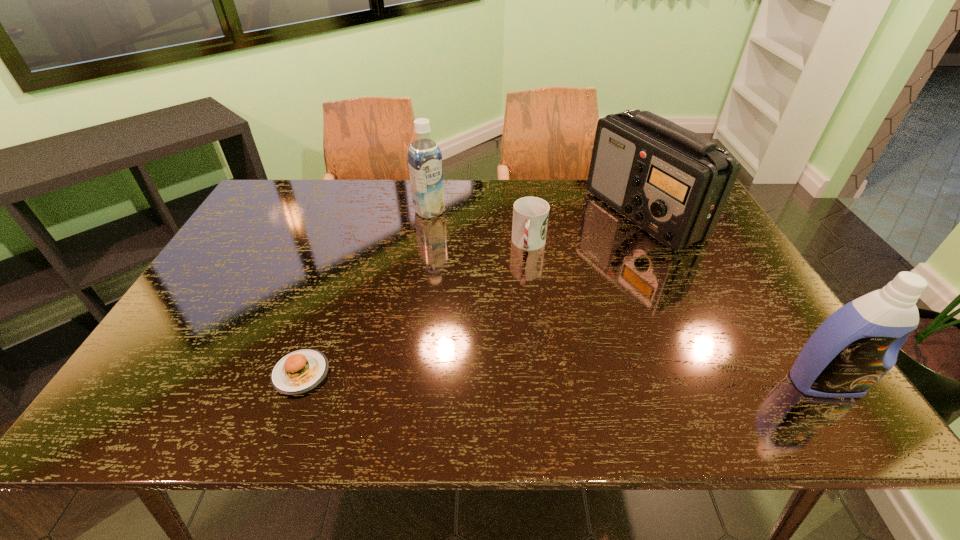
Locate an element on the screen. food present at the near edge is located at coordinates (300, 371).

I want to click on detergent located at the near edge, so click(x=858, y=344).

At what (x,y) coordinates should I click in order to perform the action: click on detergent situated at the right edge. Please return your answer as a coordinate pair (x, y). Looking at the image, I should click on (858, 344).

The image size is (960, 540). What are the coordinates of `radio receiver located in the right edge section of the desktop` in the screenshot? It's located at click(673, 183).

Find the location of `object that is at the far right corner`. object that is at the far right corner is located at coordinates (673, 183).

Identify the location of object at the near right corner. (858, 344).

The image size is (960, 540). In the image, there is a desktop. Find the location of `vacant space at the far edge`. vacant space at the far edge is located at coordinates (372, 208).

In order to click on free region at the near edge in this screenshot , I will do `click(323, 350)`.

Locate an element on the screen. This screenshot has height=540, width=960. vacant space at the left edge of the desktop is located at coordinates click(x=260, y=248).

Where is `vacant region at the right edge of the desktop`? vacant region at the right edge of the desktop is located at coordinates (716, 293).